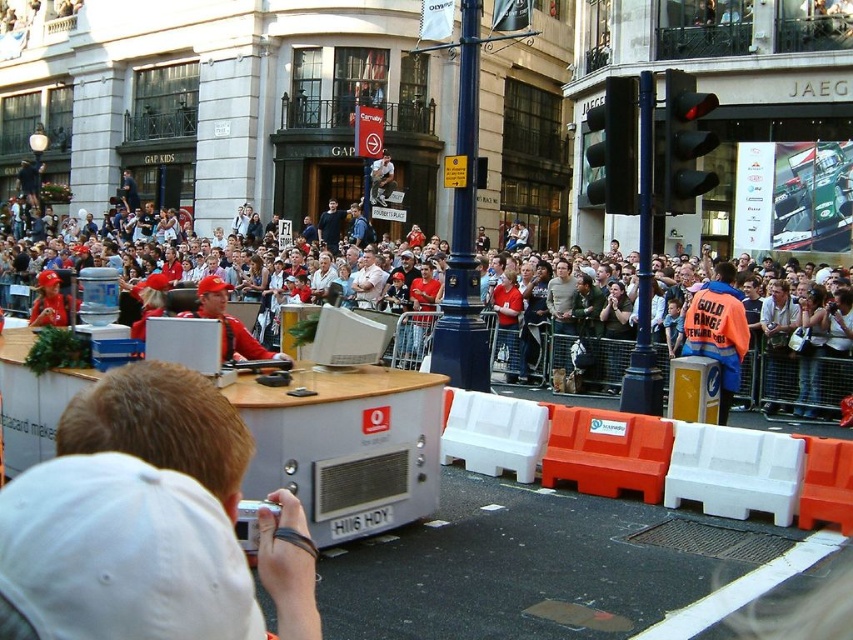
From the picture: You are a photographer positioned at the back of the crowd. You notice two groups of people wearing different colored shirts at the center of the event. The first group wears matte red shirts at center, and the second group wears dark blue shirt at center. Which group of people is blocking your view of the stage?

The matte red shirts at center are taller than the dark blue shirt at center, so the matte red shirts at center are blocking the view of the stage more than the dark blue shirt at center.

You are a photographer standing behind the man with the camera. You notice two people in the crowd wearing an orange reflective jacket at center and a dark blue shirt at center. Which one is more visible to you?

The orange reflective jacket at center is closer to the viewer than the dark blue shirt at center, so it is more visible.